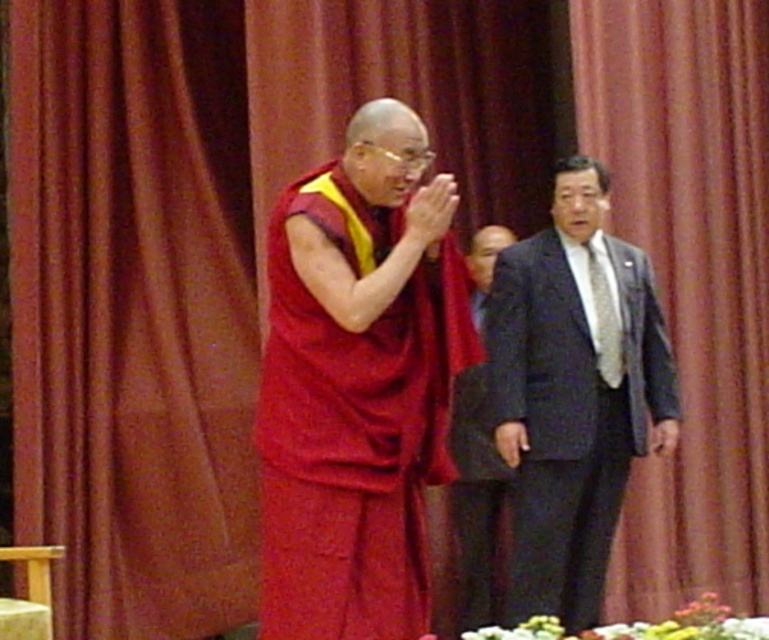
Based on the photo, you are attending a cultural event and need to take a photo of the dark gray suit at right and the dark gray suit at center. Which one should you focus on first to ensure it is in clear view?

The dark gray suit at right is closer to the viewer than the dark gray suit at center, so you should focus on the dark gray suit at right first to ensure it is in clear view.

You are a photographer setting up a shoot in front of a red curtain. You notice the matte red robe at center and the dark gray suit at center. Which clothing item is positioned higher up in the frame?

The matte red robe at center is much taller than the dark gray suit at center, so the matte red robe at center is positioned higher up in the frame.